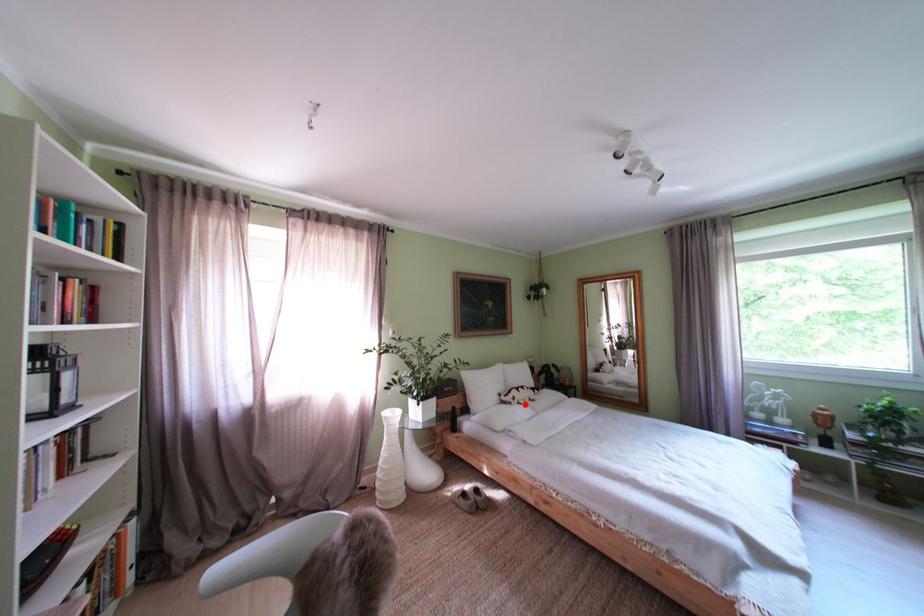
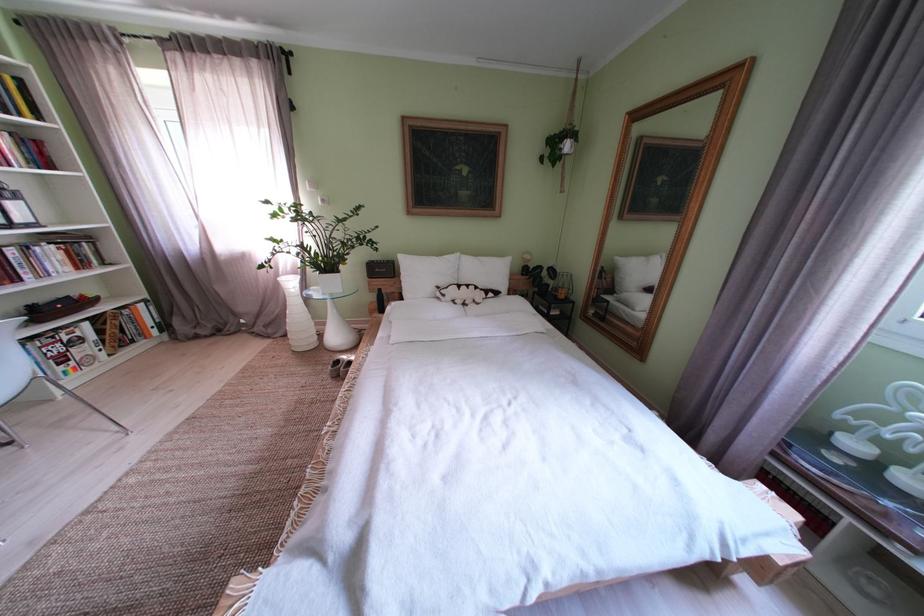
Locate, in the second image, the point that corresponds to the highlighted location in the first image.

(455, 301)